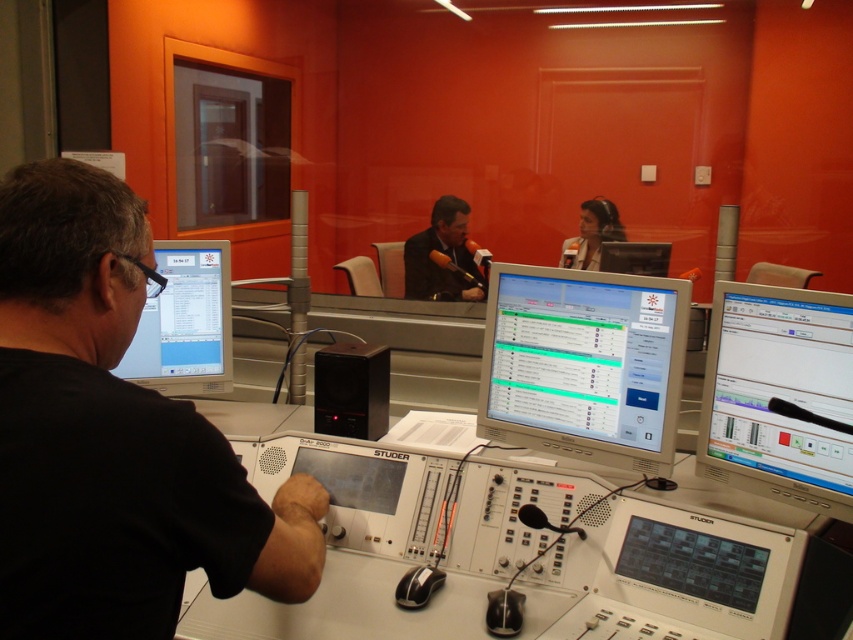
Question: Is white plastic control panel at lower center bigger than dark suit at center?

Choices:
 (A) no
 (B) yes

Answer: (B)

Question: Can you confirm if matte gray monitor at center is positioned to the left of dark suit at center?

Choices:
 (A) yes
 (B) no

Answer: (B)

Question: Which object is farther from the camera taking this photo?

Choices:
 (A) matte black monitor at left
 (B) white plastic control panel at lower center
 (C) matte black headset at upper center

Answer: (C)

Question: Which point is farther to the camera?

Choices:
 (A) (851, 396)
 (B) (778, 548)
 (C) (602, 221)

Answer: (C)

Question: Does white plastic table at center have a greater width compared to matte black monitor at left?

Choices:
 (A) yes
 (B) no

Answer: (A)

Question: Estimate the real-world distances between objects in this image. Which object is farther from the white plastic control panel at lower center?

Choices:
 (A) matte black headset at upper center
 (B) white glossy monitor at right
 (C) black matte monitor at left
 (D) matte black monitor at center

Answer: (A)